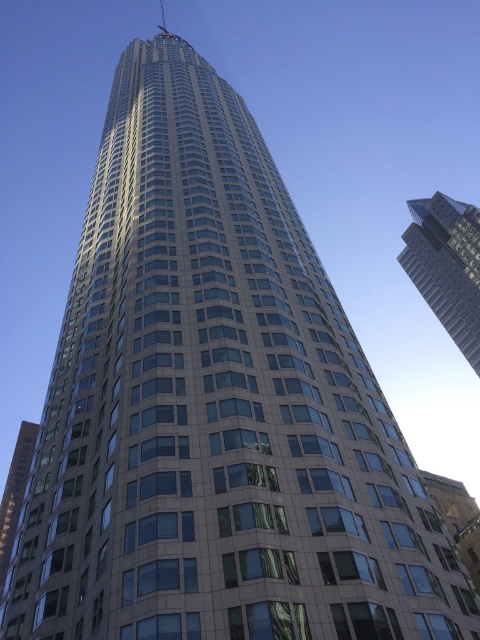
Based on the photo, is glassy reflective skyscraper at upper right bigger than glassy reflective building at lower left?

No, glassy reflective skyscraper at upper right is not bigger than glassy reflective building at lower left.

Is point (444, 204) positioned after point (9, 525)?

Yes, it is.

Between point (465, 244) and point (4, 536), which one is positioned in front?

Point (4, 536)

Where is `glassy reflective skyscraper at upper right`? The width and height of the screenshot is (480, 640). glassy reflective skyscraper at upper right is located at coordinates (446, 266).